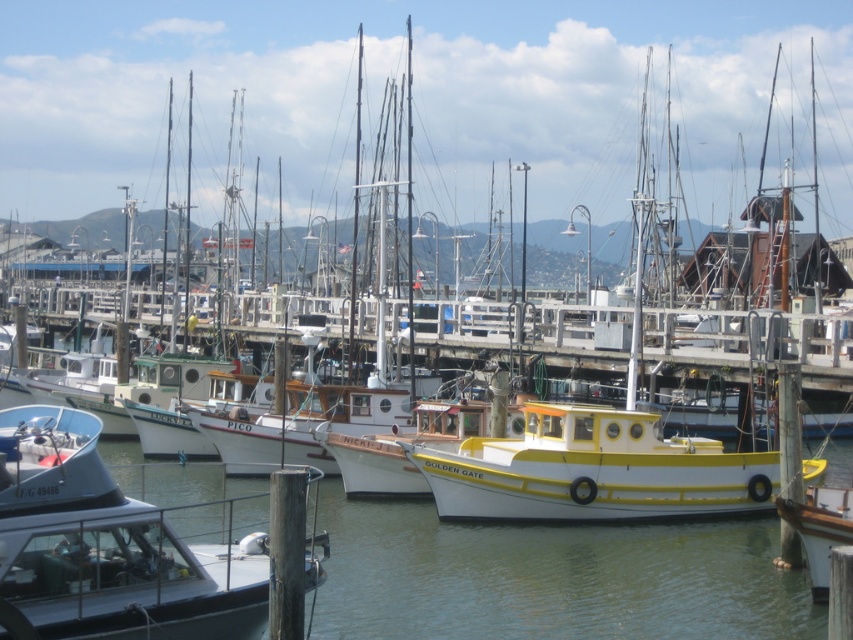
You are a dock worker who needs to load cargo onto both the matte white boat at lower left and the yellow matte boat at center. Based on their sizes, which boat can accommodate larger cargo containers?

The matte white boat at lower left might be wider than yellow matte boat at center, so it can likely accommodate larger cargo containers.